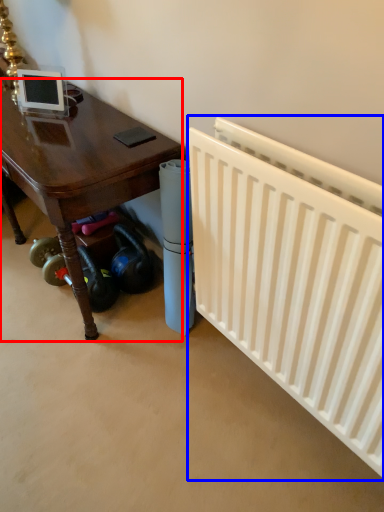
Question: Which of the following is the closest to the observer, table (highlighted by a red box) or radiator (highlighted by a blue box)?

Choices:
 (A) table
 (B) radiator

Answer: (B)